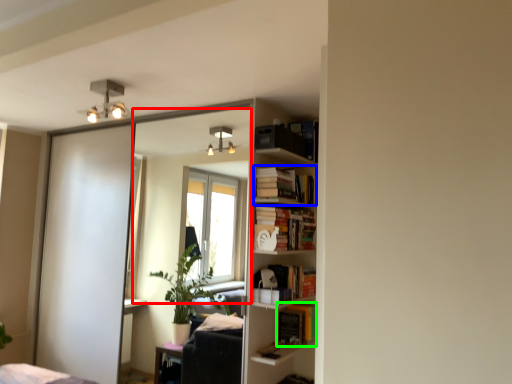
Question: Which object is positioned closest to mirror (highlighted by a red box)? Select from book (highlighted by a blue box) and book (highlighted by a green box).

Choices:
 (A) book
 (B) book

Answer: (A)